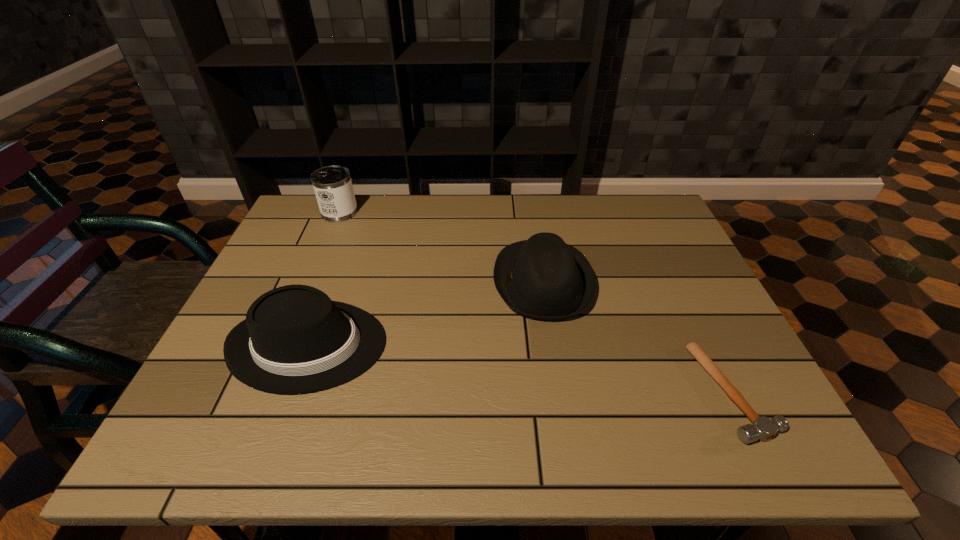
I want to click on can, so click(333, 187).

What are the coordinates of `the right fedora` in the screenshot? It's located at (543, 278).

In order to click on the left fedora in this screenshot , I will do `click(295, 339)`.

Locate an element on the screen. Image resolution: width=960 pixels, height=540 pixels. the rightmost object is located at coordinates (762, 428).

You are a GUI agent. You are given a task and a screenshot of the screen. Output one action in this format:
    pyautogui.click(x=<x>, y=<y>)
    Task: Click on the hammer
    Image resolution: width=960 pixels, height=540 pixels.
    Given the screenshot: What is the action you would take?
    pyautogui.click(x=762, y=428)

Locate an element on the screen. Image resolution: width=960 pixels, height=540 pixels. vacant region located 0.100m on the front of the can is located at coordinates (326, 242).

Identify the location of vacant space located on the front-facing side of the third object from left to right. This screenshot has width=960, height=540. (462, 282).

Image resolution: width=960 pixels, height=540 pixels. I want to click on free space located 0.150m on the front-facing side of the third object from left to right, so click(435, 282).

The height and width of the screenshot is (540, 960). In order to click on vacant area situated on the front-facing side of the third object from left to right in this screenshot , I will do `click(385, 282)`.

Identify the location of vacant area located on the front-facing side of the left fedora. Image resolution: width=960 pixels, height=540 pixels. (452, 345).